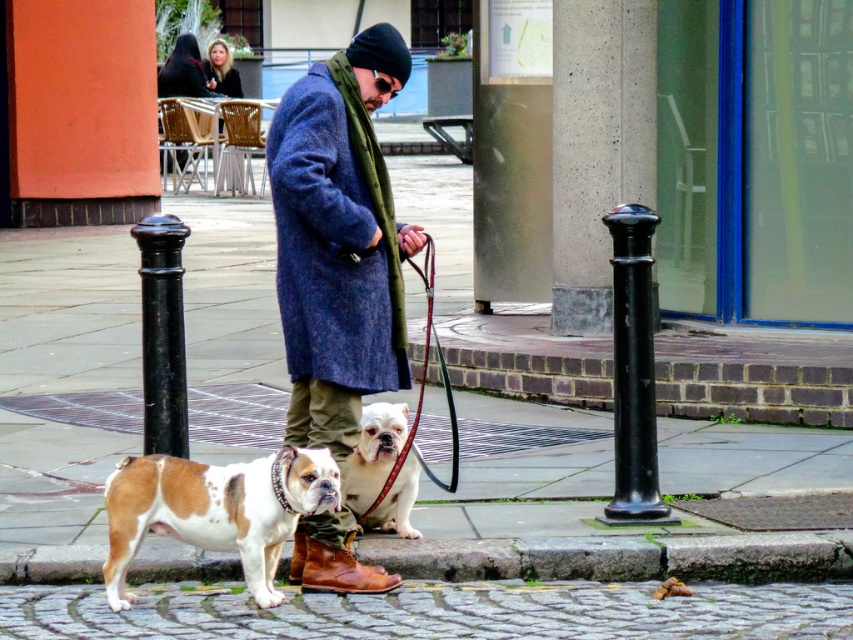
Question: Which point is closer to the camera?

Choices:
 (A) white and brown fur at center
 (B) leather at lower center
 (C) cobblestone pavement at lower center
 (D) brown leather boot at lower center

Answer: (C)

Question: Which point is farther from the camera taking this photo?

Choices:
 (A) (612, 252)
 (B) (402, 452)
 (C) (386, 301)
 (D) (451, 595)

Answer: (A)

Question: Can you confirm if blue wool coat at center is positioned to the left of black polished metal pole at center?

Choices:
 (A) no
 (B) yes

Answer: (A)

Question: Which of the following is the closest to the observer?

Choices:
 (A) (399, 452)
 (B) (349, 84)

Answer: (B)

Question: Is cobblestone pavement at lower center below black polished metal pole at center?

Choices:
 (A) no
 (B) yes

Answer: (B)

Question: Is black polished metal pole at center further to the viewer compared to brown leather boot at lower center?

Choices:
 (A) no
 (B) yes

Answer: (B)